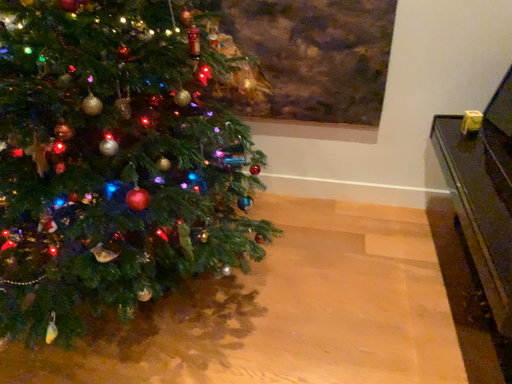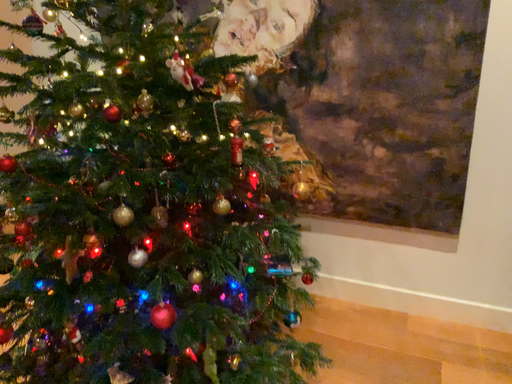
Question: How did the camera likely rotate when shooting the video?

Choices:
 (A) rotated left
 (B) rotated right

Answer: (A)